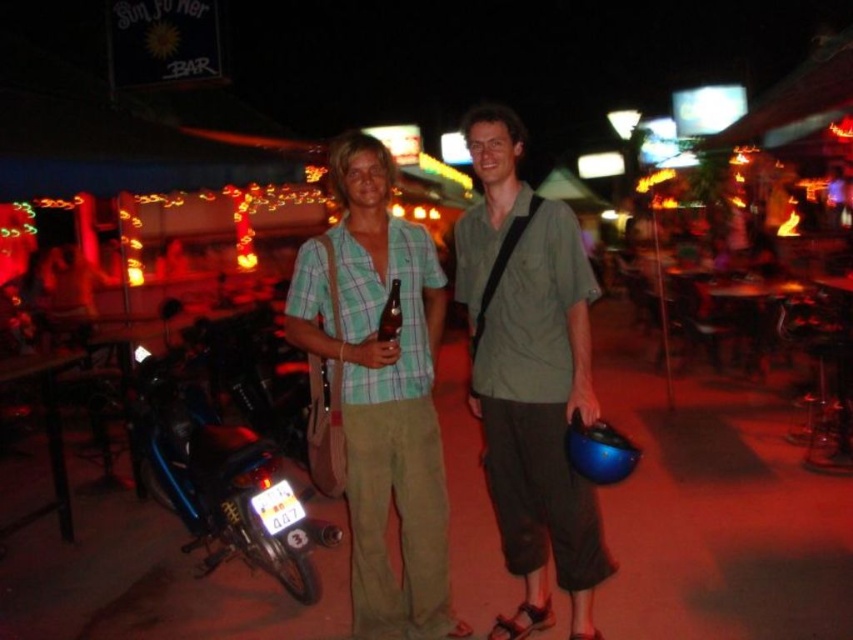
Question: Which point is farther to the camera?

Choices:
 (A) metallic blue motorcycle at lower left
 (B) green plaid shirt at center

Answer: (A)

Question: Does green plaid shirt at center appear under metallic blue motorcycle at lower left?

Choices:
 (A) no
 (B) yes

Answer: (A)

Question: Which of the following is the farthest from the observer?

Choices:
 (A) green plaid shirt at center
 (B) green cotton shirt at center

Answer: (A)

Question: Does green plaid shirt at center have a greater width compared to metallic blue motorcycle at lower left?

Choices:
 (A) no
 (B) yes

Answer: (A)

Question: Does green plaid shirt at center appear on the left side of metallic blue motorcycle at lower left?

Choices:
 (A) yes
 (B) no

Answer: (B)

Question: Considering the real-world distances, which object is farthest from the green cotton shirt at center?

Choices:
 (A) metallic blue motorcycle at lower left
 (B) green plaid shirt at center

Answer: (A)